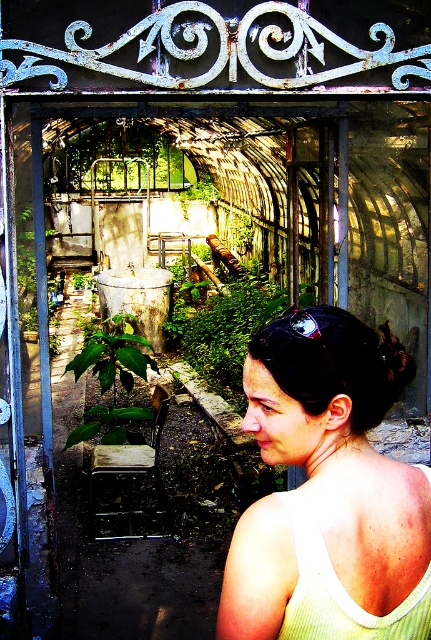
You are standing at the entrance of the greenhouse and see two points marked in the image. The first point is at coordinates point [399,497] and the second is at point [311,564]. Which point is closer to you?

Point [311,564] is closer to you because point [399,497] is behind it.

You are a fashion designer observing a model wearing the light yellow knit tank top at center and the green striped vest at upper right. Which clothing item is layered on top?

The light yellow knit tank top at center is positioned over the green striped vest at upper right, so it is the clothing item layered on top.

You are a fashion designer observing a model wearing the light yellow knit tank top at center and the green striped vest at upper right. Which clothing item is taller?

The light yellow knit tank top at center has a greater height compared to the green striped vest at upper right, so the light yellow knit tank top at center is taller.